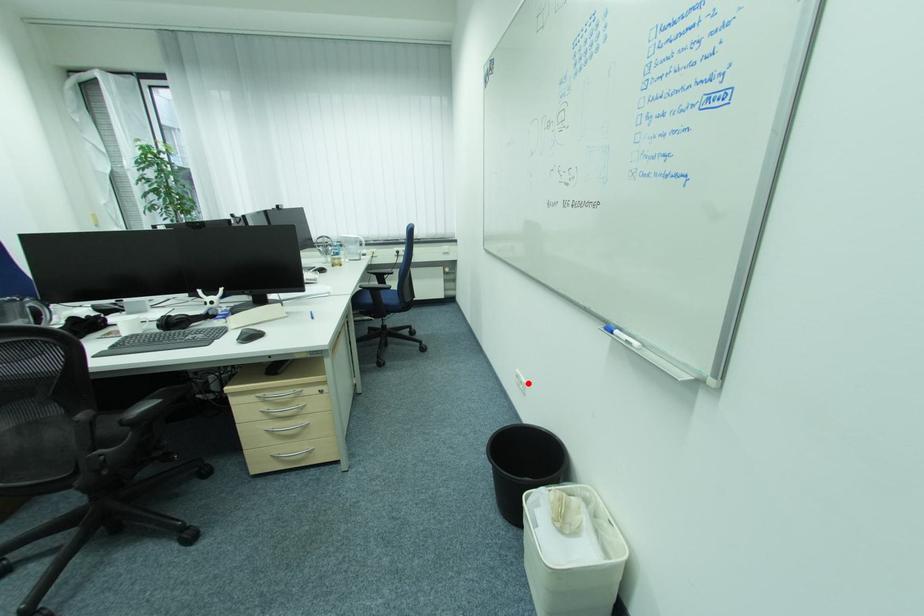
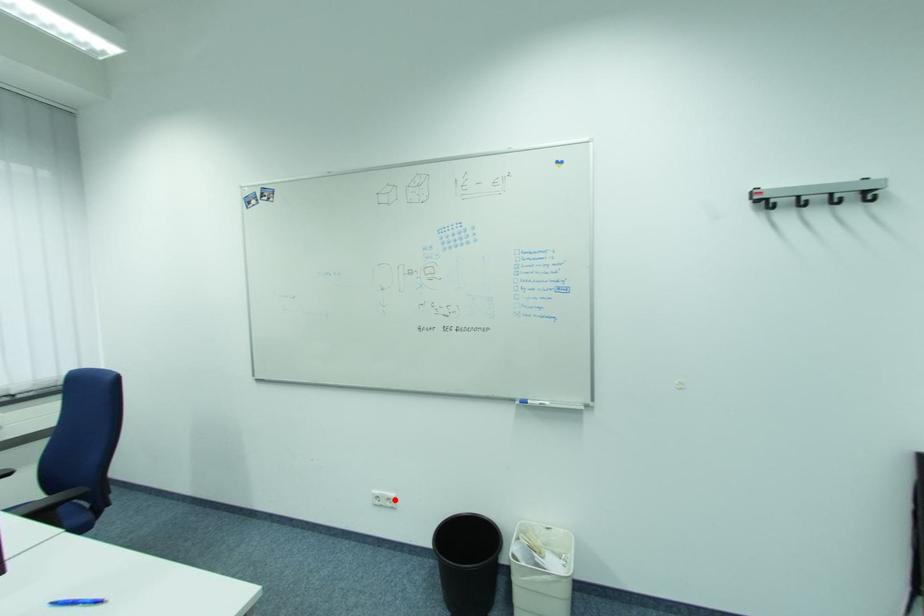
I am providing you with two images of the same scene from different viewpoints. A red point is marked on the first image and another point is marked on the second image. Does the point marked in image1 correspond to the same location as the one in image2?

Yes